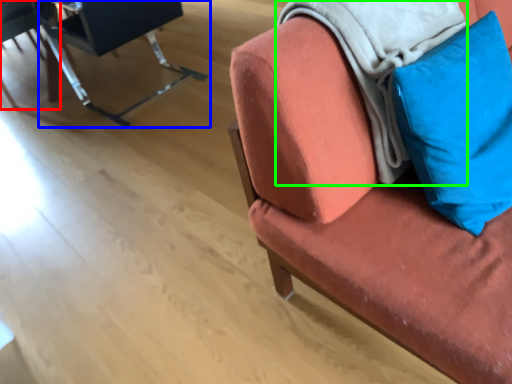
Question: Which is nearer to the chair (highlighted by a red box)? chair (highlighted by a blue box) or blanket (highlighted by a green box).

Choices:
 (A) chair
 (B) blanket

Answer: (A)